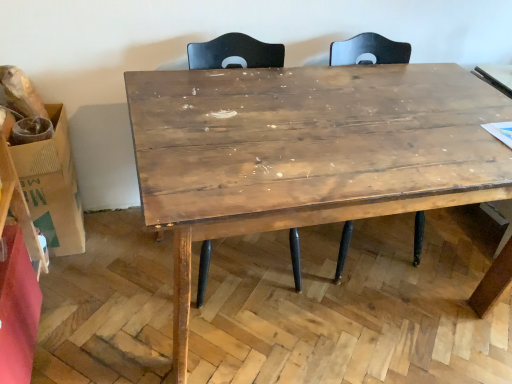
Question: Is wooden table at center further to camera compared to brown cardboard box at left?

Choices:
 (A) no
 (B) yes

Answer: (A)

Question: From a real-world perspective, is wooden table at center physically below brown cardboard box at left?

Choices:
 (A) no
 (B) yes

Answer: (A)

Question: Considering the relative positions of wooden table at center and brown cardboard box at left in the image provided, is wooden table at center to the left of brown cardboard box at left from the viewer's perspective?

Choices:
 (A) no
 (B) yes

Answer: (A)

Question: Considering the relative sizes of wooden table at center and brown cardboard box at left in the image provided, is wooden table at center wider than brown cardboard box at left?

Choices:
 (A) yes
 (B) no

Answer: (A)

Question: Does wooden table at center have a smaller size compared to brown cardboard box at left?

Choices:
 (A) no
 (B) yes

Answer: (A)

Question: Is wooden table at center oriented towards brown cardboard box at left?

Choices:
 (A) no
 (B) yes

Answer: (A)

Question: Does matte wood swivel chair at center have a smaller size compared to brown cardboard box at left?

Choices:
 (A) yes
 (B) no

Answer: (B)

Question: Is matte wood swivel chair at center facing away from brown cardboard box at left?

Choices:
 (A) no
 (B) yes

Answer: (A)

Question: From a real-world perspective, is matte wood swivel chair at center located higher than brown cardboard box at left?

Choices:
 (A) yes
 (B) no

Answer: (A)

Question: From the image's perspective, would you say matte wood swivel chair at center is positioned over brown cardboard box at left?

Choices:
 (A) no
 (B) yes

Answer: (B)

Question: Is matte wood swivel chair at center closer to the viewer compared to brown cardboard box at left?

Choices:
 (A) no
 (B) yes

Answer: (B)

Question: Is brown cardboard box at left a part of matte wood swivel chair at center?

Choices:
 (A) no
 (B) yes

Answer: (A)

Question: From the image's perspective, is brown cardboard box at left located above wooden table at center?

Choices:
 (A) yes
 (B) no

Answer: (A)